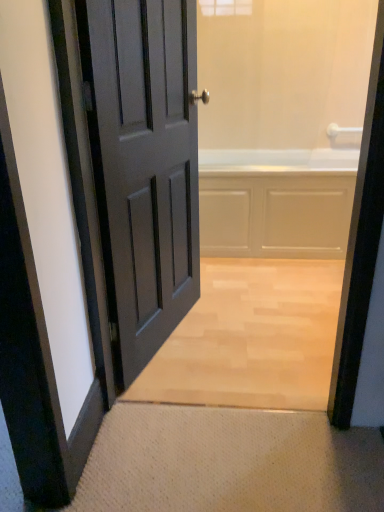
Image resolution: width=384 pixels, height=512 pixels. I want to click on empty space that is ontop of white textured mat at lower center (from a real-world perspective), so click(x=232, y=454).